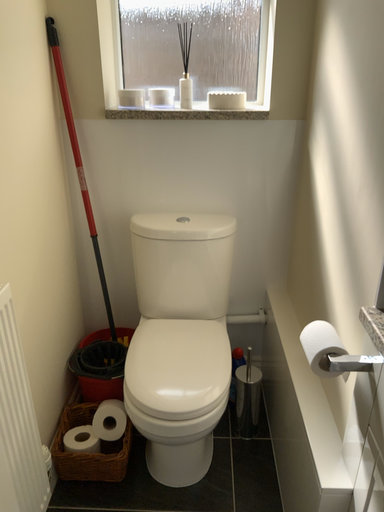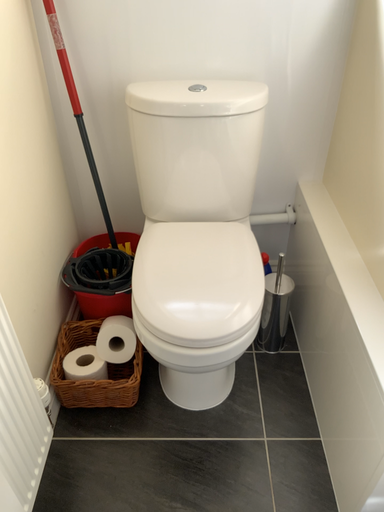
Question: How did the camera likely rotate when shooting the video?

Choices:
 (A) rotated downward
 (B) rotated upward

Answer: (A)